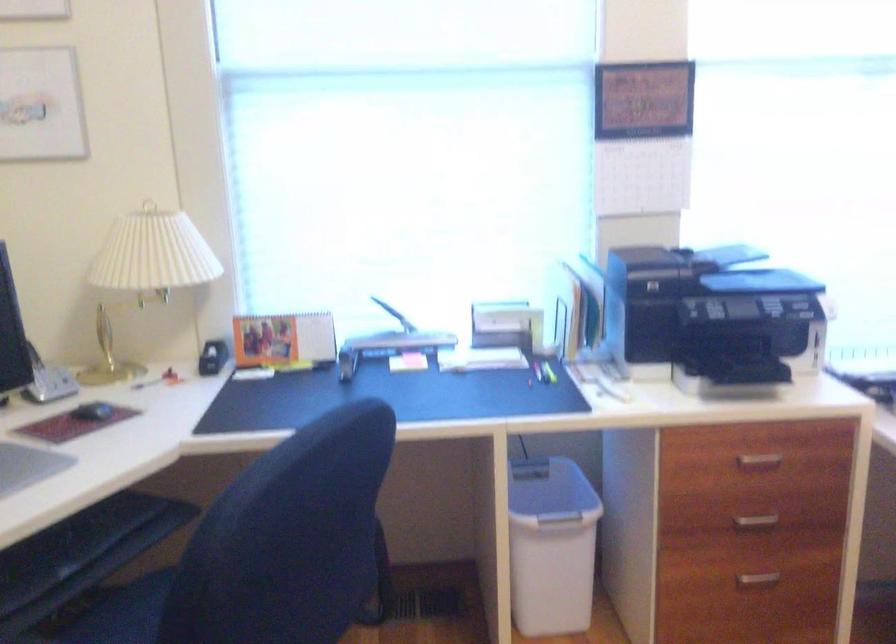
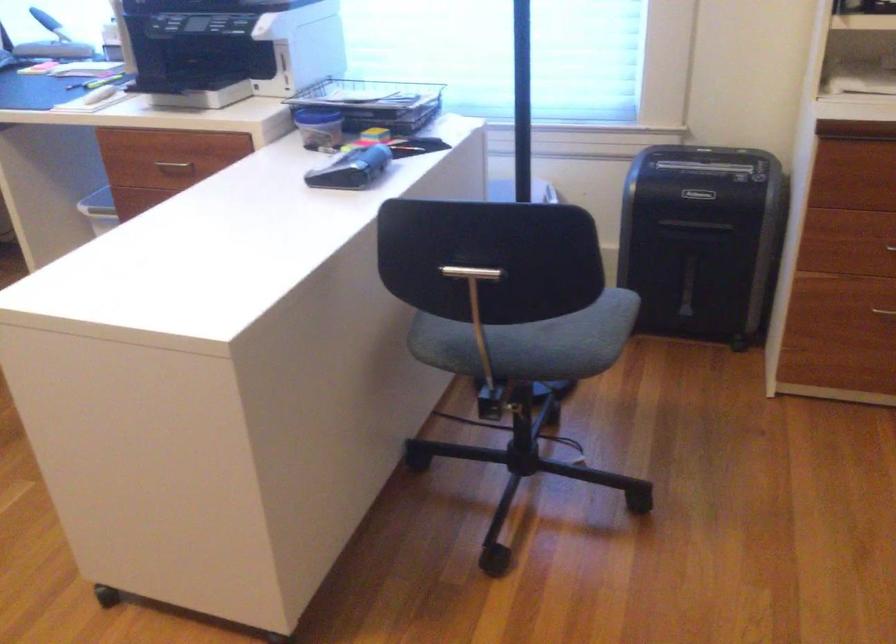
Question: The images are taken continuously from a first-person perspective. In which direction are you moving?

Choices:
 (A) Left
 (B) Right
 (C) Forward
 (D) Backward

Answer: (B)